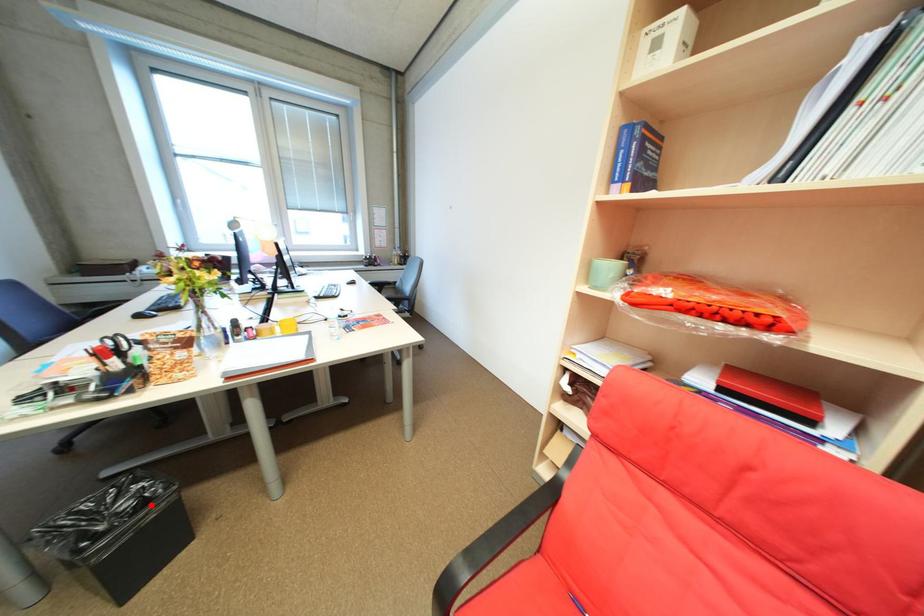
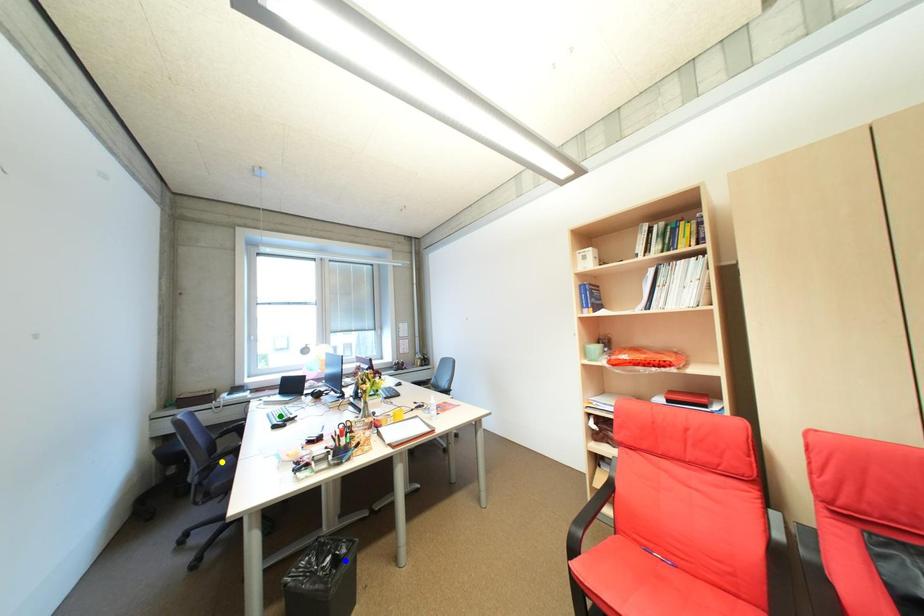
Question: I am providing you with two images of the same scene from different viewpoints. A red point is marked on the first image. You are given multiple points on the second image. Which spot in image 2 lines up with the point in image 1?

Choices:
 (A) blue point
 (B) green point
 (C) yellow point

Answer: (A)